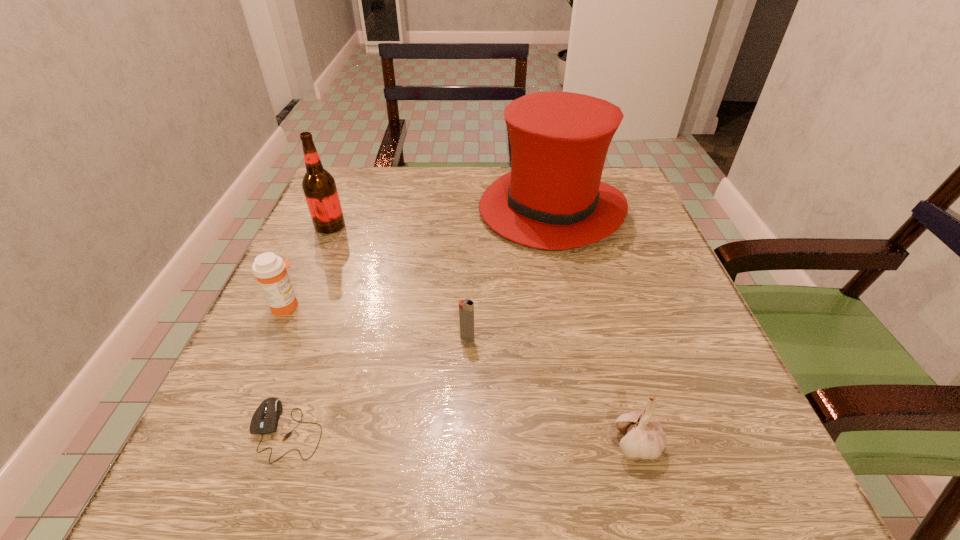
Locate an element on the screen. This screenshot has width=960, height=540. free space between the igniter and the root beer is located at coordinates (398, 282).

Select which object is the closest to the fourth farthest object. Please provide its 2D coordinates. Your answer should be formatted as a tuple, i.e. [(x, y)], where the tuple contains the x and y coordinates of a point satisfying the conditions above.

[(553, 198)]

Choose which object is the fifth nearest neighbor to the medicine. Please provide its 2D coordinates. Your answer should be formatted as a tuple, i.e. [(x, y)], where the tuple contains the x and y coordinates of a point satisfying the conditions above.

[(644, 438)]

The width and height of the screenshot is (960, 540). In order to click on free point that satisfies the following two spatial constraints: 1. on the back side of the hat; 2. on the left side of the third tallest object in this screenshot , I will do `click(330, 209)`.

In order to click on vacant space that satisfies the following two spatial constraints: 1. on the back side of the root beer; 2. on the left side of the hat in this screenshot , I will do `click(337, 209)`.